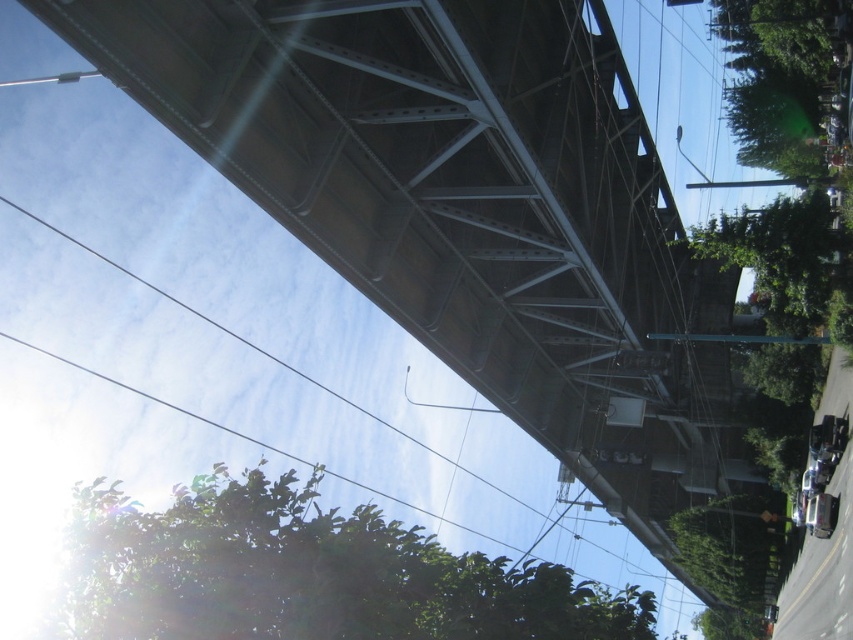
The image size is (853, 640). What do you see at coordinates (822, 474) in the screenshot? I see `shiny black car at lower right` at bounding box center [822, 474].

Is shiny black car at lower right positioned at the back of green matte skateboard at lower right?

No, it is in front of green matte skateboard at lower right.

You are a GUI agent. You are given a task and a screenshot of the screen. Output one action in this format:
    pyautogui.click(x=<x>, y=<y>)
    Task: Click on the shiny black car at lower right
    This screenshot has height=640, width=853.
    Given the screenshot: What is the action you would take?
    pyautogui.click(x=822, y=474)